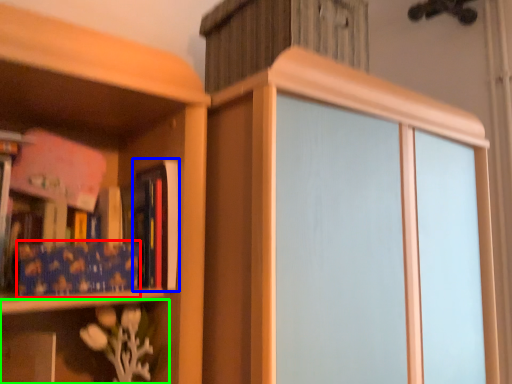
Question: Which object is positioned farthest from paperback book (highlighted by a red box)? Select from book (highlighted by a blue box) and shelf (highlighted by a green box).

Choices:
 (A) book
 (B) shelf

Answer: (B)